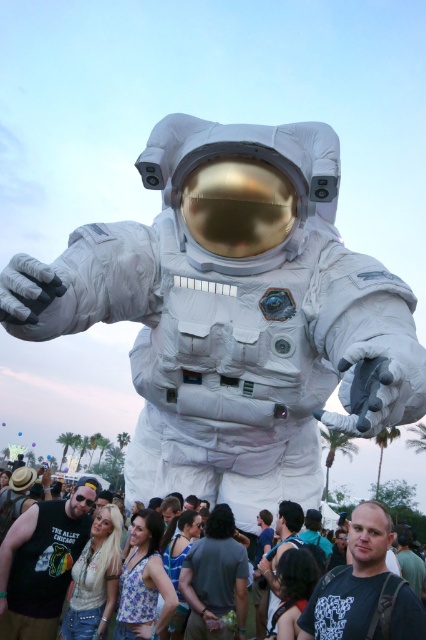
Who is more forward, (293,182) or (8,568)?

Point (293,182) is in front.

In the scene shown: Between white fabric astronaut at center and white fabric crowd at center, which one is positioned lower?

Positioned lower is white fabric crowd at center.

You are a GUI agent. You are given a task and a screenshot of the screen. Output one action in this format:
    pyautogui.click(x=<x>, y=<y>)
    Task: Click on the white fabric astronaut at center
    
    Given the screenshot: What is the action you would take?
    pyautogui.click(x=235, y=314)

Is dark gray t-shirt at center behind white fabric crowd at center?

No, it is not.

This screenshot has width=426, height=640. What are the coordinates of `dark gray t-shirt at center` in the screenshot? It's located at (363, 589).

Does black t-shirt at center have a greater width compared to dark gray t-shirt at center?

Yes, black t-shirt at center is wider than dark gray t-shirt at center.

Between black t-shirt at center and dark gray t-shirt at center, which one appears on the right side from the viewer's perspective?

From the viewer's perspective, dark gray t-shirt at center appears more on the right side.

Which is in front, point (81, 532) or point (373, 518)?

Point (373, 518) is more forward.

Find the location of a particular element. black t-shirt at center is located at coordinates (42, 563).